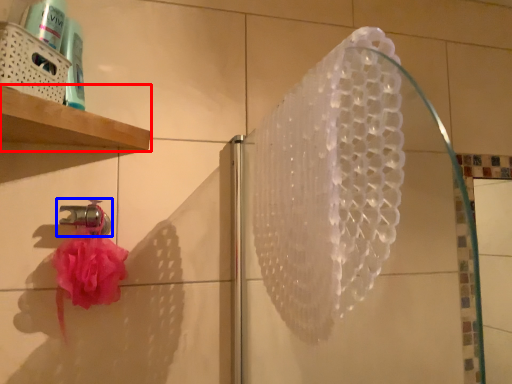
Question: Which of the following is the closest to the observer, shelf (highlighted by a red box) or tap (highlighted by a blue box)?

Choices:
 (A) shelf
 (B) tap

Answer: (A)